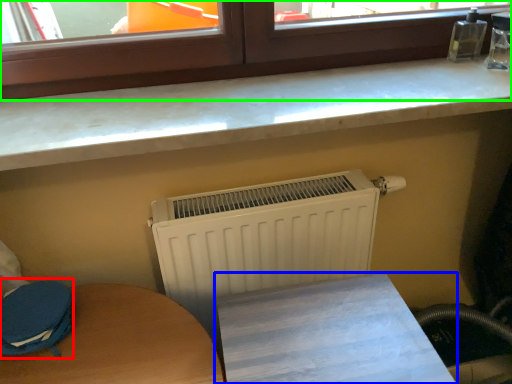
Question: Estimate the real-world distances between objects in this image. Which object is farther from swivel chair (highlighted by a red box), furniture (highlighted by a blue box) or window (highlighted by a green box)?

Choices:
 (A) furniture
 (B) window

Answer: (B)